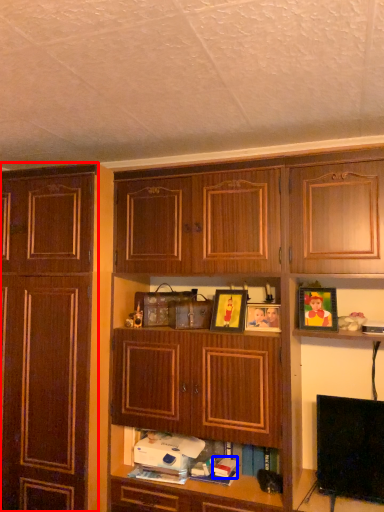
Question: Which object is further to the camera taking this photo, cabinetry (highlighted by a red box) or book (highlighted by a blue box)?

Choices:
 (A) cabinetry
 (B) book

Answer: (B)